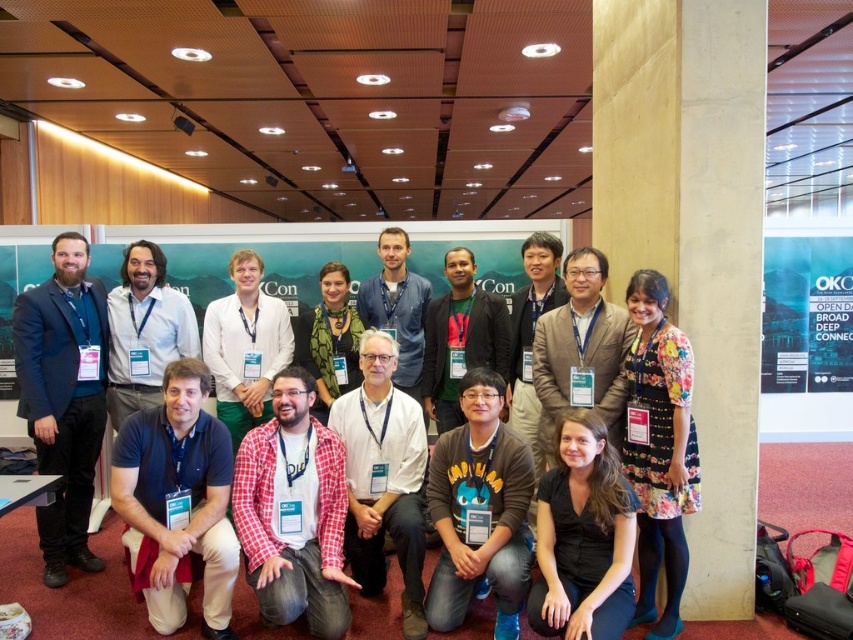
You are at the OKO OPEN DAY event and see a point marked at coordinates (62, 397). Which object in the scene does this point correspond to?

The point at coordinates (62, 397) is located on the dark blue suit at left.

You are standing in the conference venue and notice two points marked in the image. The first point is at coordinate point [16,328] and the second is at point [607,385]. Which point is closer to you?

Point [16,328] is closer to you because it is further to the camera than point [607,385].

Where is the green fabric shirt at center located in the image?

The green fabric shirt at center is located at point (460, 339) in the image.